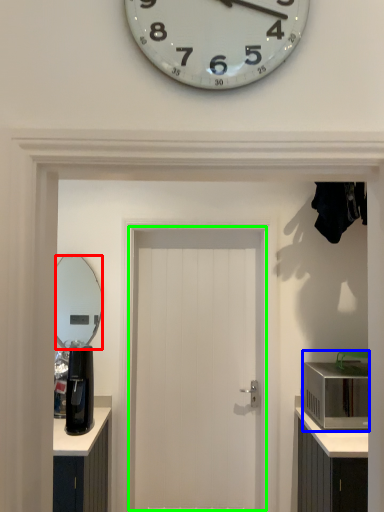
Question: Considering the real-world distances, which object is farthest from mirror (highlighted by a red box)? appliance (highlighted by a blue box) or door (highlighted by a green box)?

Choices:
 (A) appliance
 (B) door

Answer: (A)